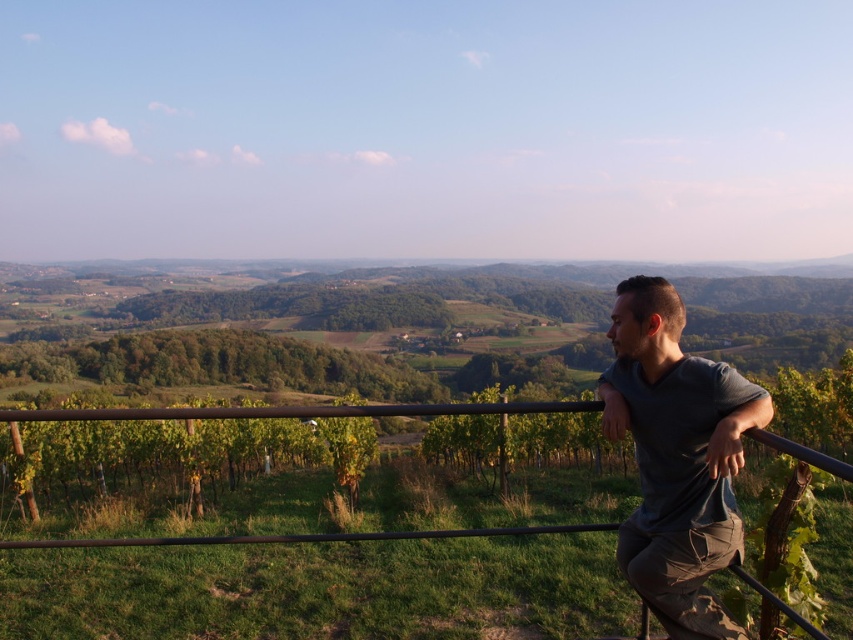
Is point (663, 289) more distant than point (84, 412)?

No, (663, 289) is closer to viewer.

Can you confirm if gray cotton shirt at right is wider than black metal fence at lower right?

Incorrect, gray cotton shirt at right's width does not surpass black metal fence at lower right's.

Is point (677, 456) closer to camera compared to point (360, 532)?

Yes, it is.

Image resolution: width=853 pixels, height=640 pixels. Find the location of `gray cotton shirt at right`. gray cotton shirt at right is located at coordinates (676, 458).